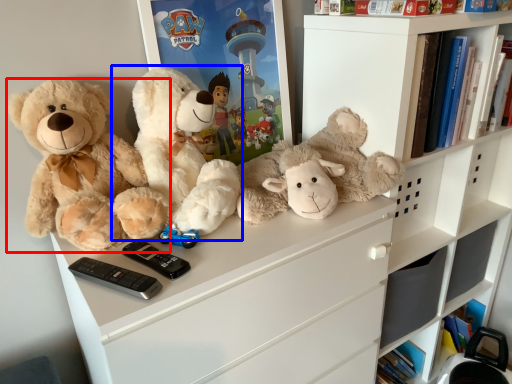
Question: Which of the following is the farthest to the observer, teddy bear (highlighted by a red box) or teddy bear (highlighted by a blue box)?

Choices:
 (A) teddy bear
 (B) teddy bear

Answer: (B)